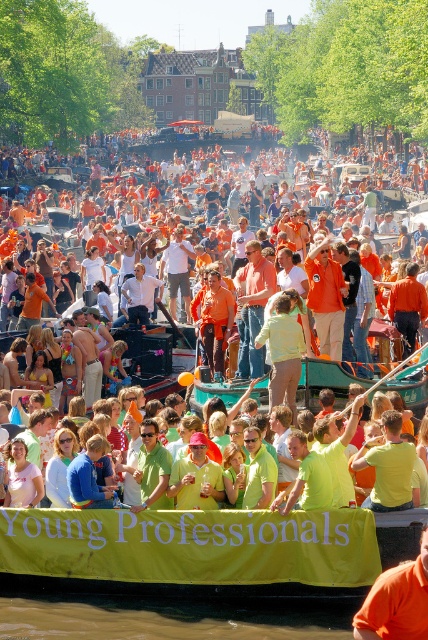
You are a photographer trying to capture a photo of the crowd at the canal event. You notice two people wearing the matte orange shirt at center and the bright yellow shirt at center. Which shirt is taller in the photo?

The matte orange shirt at center is taller than the bright yellow shirt at center.

You are standing on the canal side and see the orange fabric at center and the pastel green fabric at center. Which fabric is positioned more to the right side of the canal?

The orange fabric at center is positioned more to the right side of the canal because it is to the right of the pastel green fabric at center.